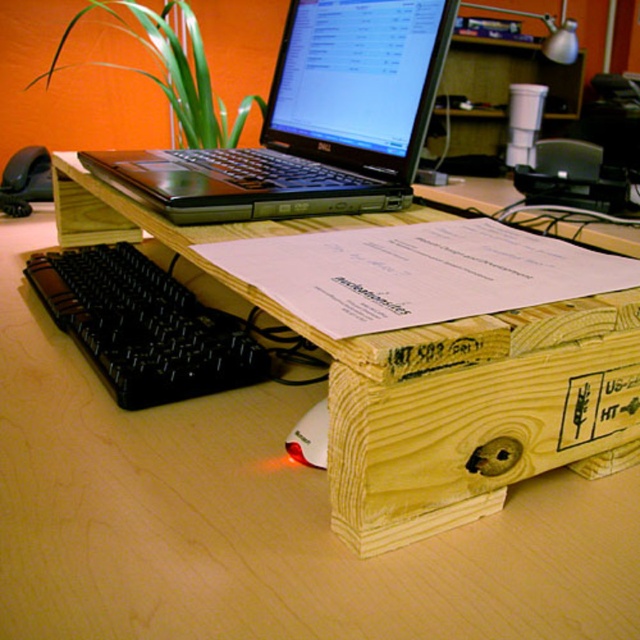
Measure the distance between black plastic keyboard at lower left and white matte mouse at lower center.

black plastic keyboard at lower left is 11.72 inches from white matte mouse at lower center.

Can you confirm if black plastic keyboard at lower left is taller than white matte mouse at lower center?

Indeed, black plastic keyboard at lower left has a greater height compared to white matte mouse at lower center.

Who is more forward, (x=195, y=374) or (x=321, y=413)?

Positioned in front is point (x=321, y=413).

Where is `black plastic keyboard at lower left`? The image size is (640, 640). black plastic keyboard at lower left is located at coordinates (144, 326).

Where is `black matte laptop at upper center`? This screenshot has width=640, height=640. black matte laptop at upper center is located at coordinates (312, 122).

Which is in front, point (419, 131) or point (140, 259)?

Point (419, 131)

You are a GUI agent. You are given a task and a screenshot of the screen. Output one action in this format:
    pyautogui.click(x=<x>, y=<y>)
    Task: Click on the black matte laptop at upper center
    This screenshot has width=640, height=640.
    Given the screenshot: What is the action you would take?
    pyautogui.click(x=312, y=122)

This screenshot has width=640, height=640. Find the location of `black matte laptop at upper center`. black matte laptop at upper center is located at coordinates (312, 122).

Looking at this image, is black matte laptop at upper center thinner than white matte mouse at lower center?

Incorrect, black matte laptop at upper center's width is not less than white matte mouse at lower center's.

Is black matte laptop at upper center wider than white matte mouse at lower center?

Yes.

Describe the element at coordinates (312, 122) in the screenshot. I see `black matte laptop at upper center` at that location.

Find the location of a particular element. This screenshot has width=640, height=640. black matte laptop at upper center is located at coordinates (312, 122).